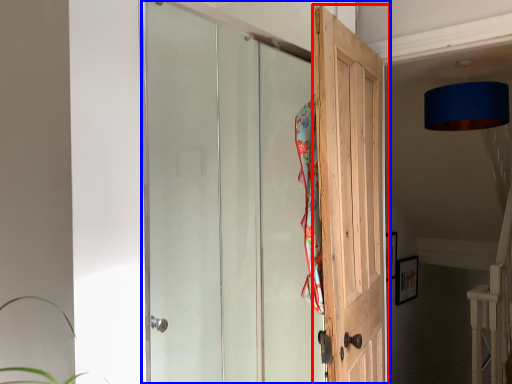
Question: Which of the following is the farthest to the observer, door (highlighted by a red box) or door (highlighted by a blue box)?

Choices:
 (A) door
 (B) door

Answer: (A)